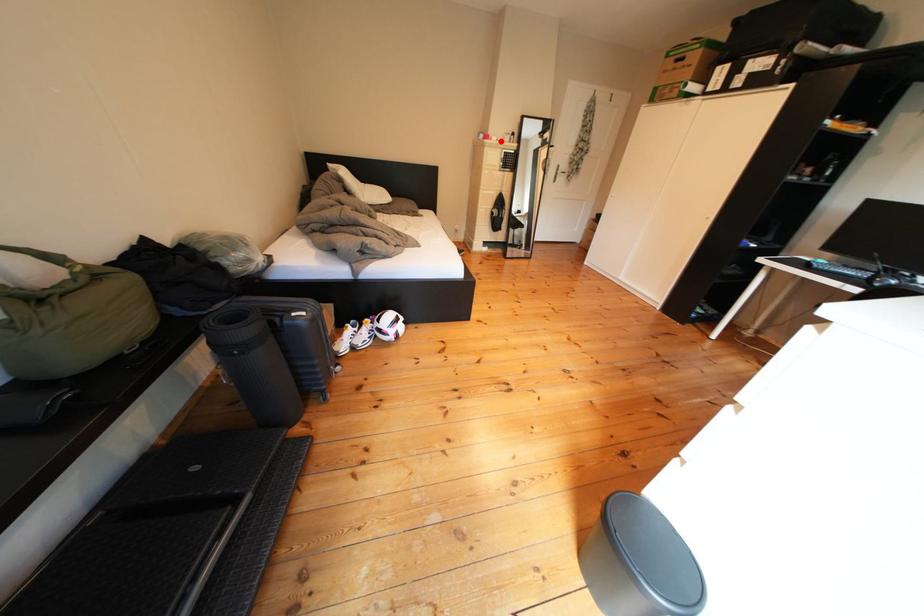
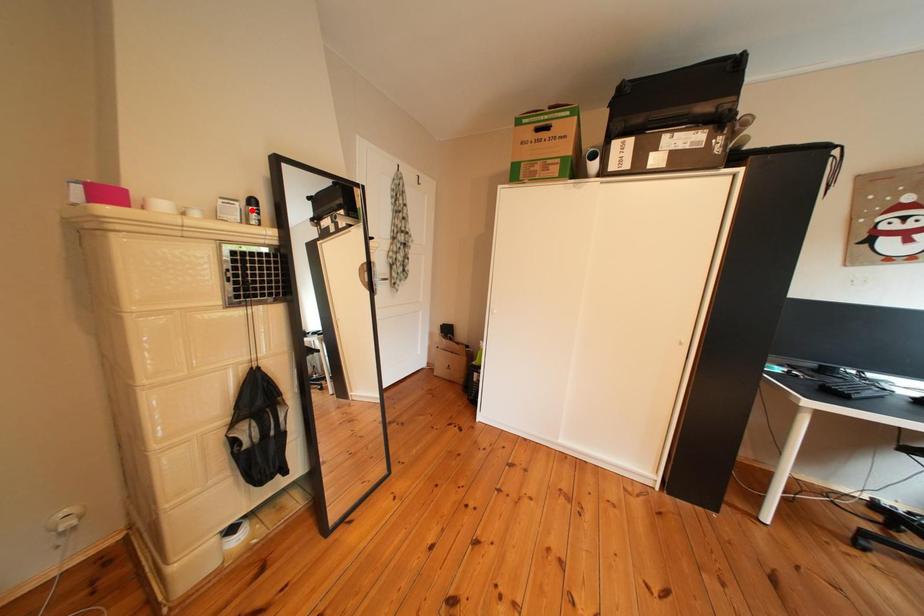
I am providing you with two images of the same scene from different viewpoints. A red point is marked on the first image and another point is marked on the second image. Is the marked point in image1 the same physical position as the marked point in image2?

No